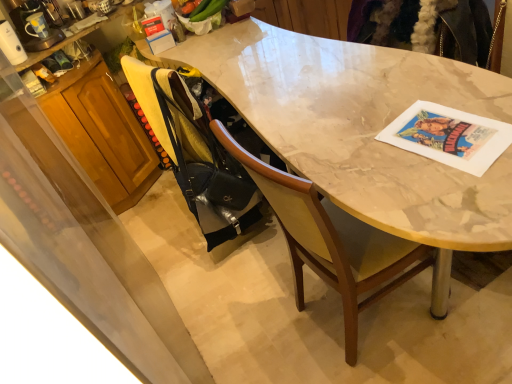
Question: Is wooden cabinet at left not near marble table at center?

Choices:
 (A) yes
 (B) no

Answer: (B)

Question: Can you confirm if wooden cabinet at left is thinner than marble table at center?

Choices:
 (A) no
 (B) yes

Answer: (B)

Question: Is wooden cabinet at left placed right next to marble table at center?

Choices:
 (A) yes
 (B) no

Answer: (B)

Question: Considering the relative positions of wooden cabinet at left and marble table at center in the image provided, is wooden cabinet at left to the left of marble table at center from the viewer's perspective?

Choices:
 (A) no
 (B) yes

Answer: (B)

Question: Considering the relative sizes of wooden cabinet at left and marble table at center in the image provided, is wooden cabinet at left bigger than marble table at center?

Choices:
 (A) no
 (B) yes

Answer: (A)

Question: In terms of height, does white glossy coffee maker at upper left look taller or shorter compared to marble table at center?

Choices:
 (A) short
 (B) tall

Answer: (A)

Question: From the image's perspective, relative to marble table at center, is white glossy coffee maker at upper left above or below?

Choices:
 (A) above
 (B) below

Answer: (A)

Question: Considering the positions of white glossy coffee maker at upper left and marble table at center in the image, is white glossy coffee maker at upper left bigger or smaller than marble table at center?

Choices:
 (A) big
 (B) small

Answer: (B)

Question: Considering the relative positions of white glossy coffee maker at upper left and marble table at center in the image provided, is white glossy coffee maker at upper left to the left or to the right of marble table at center?

Choices:
 (A) right
 (B) left

Answer: (B)

Question: From the image's perspective, is black matte handbag at lower left positioned above or below white glossy coffee maker at upper left?

Choices:
 (A) below
 (B) above

Answer: (A)

Question: Is black matte handbag at lower left taller or shorter than white glossy coffee maker at upper left?

Choices:
 (A) short
 (B) tall

Answer: (B)

Question: Is point (152, 125) positioned closer to the camera than point (14, 39)?

Choices:
 (A) closer
 (B) farther

Answer: (A)

Question: Which is correct: black matte handbag at lower left is inside white glossy coffee maker at upper left, or outside of it?

Choices:
 (A) outside
 (B) inside

Answer: (A)

Question: Which is correct: black matte handbag at lower left is inside wooden cabinet at left, or outside of it?

Choices:
 (A) inside
 (B) outside

Answer: (B)

Question: Considering their positions, is black matte handbag at lower left located in front of or behind wooden cabinet at left?

Choices:
 (A) behind
 (B) front

Answer: (B)